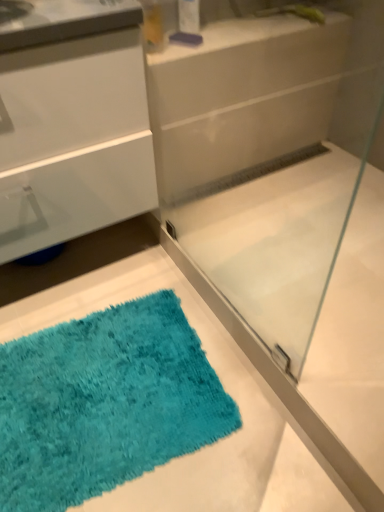
Question: Are turquoise shaggy bath mat at lower left and transparent glass shower door at center far apart?

Choices:
 (A) no
 (B) yes

Answer: (A)

Question: From a real-world perspective, is turquoise shaggy bath mat at lower left on transparent glass shower door at center?

Choices:
 (A) yes
 (B) no

Answer: (B)

Question: Considering the relative positions of turquoise shaggy bath mat at lower left and transparent glass shower door at center in the image provided, is turquoise shaggy bath mat at lower left behind transparent glass shower door at center?

Choices:
 (A) no
 (B) yes

Answer: (B)

Question: Is turquoise shaggy bath mat at lower left located outside transparent glass shower door at center?

Choices:
 (A) yes
 (B) no

Answer: (A)

Question: Is turquoise shaggy bath mat at lower left oriented towards transparent glass shower door at center?

Choices:
 (A) no
 (B) yes

Answer: (A)

Question: From the image's perspective, relative to transparent glass shower door at center, is turquoise shaggy bath mat at lower left above or below?

Choices:
 (A) below
 (B) above

Answer: (A)

Question: Is turquoise shaggy bath mat at lower left taller or shorter than transparent glass shower door at center?

Choices:
 (A) short
 (B) tall

Answer: (A)

Question: Considering the positions of point (142, 413) and point (332, 31), is point (142, 413) closer or farther from the camera than point (332, 31)?

Choices:
 (A) closer
 (B) farther

Answer: (A)

Question: From a real-world perspective, relative to transparent glass shower door at center, is turquoise shaggy bath mat at lower left vertically above or below?

Choices:
 (A) above
 (B) below

Answer: (B)

Question: In terms of height, does turquoise shaggy bath mat at lower left look taller or shorter compared to white glossy counter at upper center?

Choices:
 (A) tall
 (B) short

Answer: (A)

Question: Considering the relative positions of turquoise shaggy bath mat at lower left and white glossy counter at upper center in the image provided, is turquoise shaggy bath mat at lower left to the left or to the right of white glossy counter at upper center?

Choices:
 (A) left
 (B) right

Answer: (A)

Question: From the image's perspective, is turquoise shaggy bath mat at lower left located above or below white glossy counter at upper center?

Choices:
 (A) above
 (B) below

Answer: (B)

Question: In terms of width, does turquoise shaggy bath mat at lower left look wider or thinner when compared to white glossy counter at upper center?

Choices:
 (A) thin
 (B) wide

Answer: (B)

Question: From a real-world perspective, is white glossy counter at upper center physically located above or below turquoise shaggy bath mat at lower left?

Choices:
 (A) above
 (B) below

Answer: (A)

Question: In the image, is white glossy counter at upper center positioned in front of or behind turquoise shaggy bath mat at lower left?

Choices:
 (A) behind
 (B) front

Answer: (A)